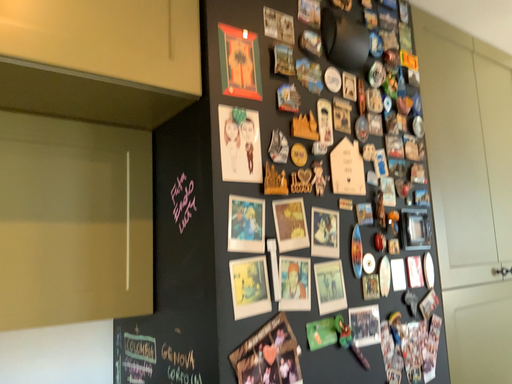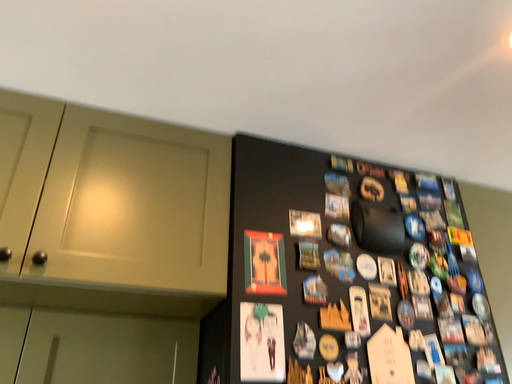
Question: How did the camera likely rotate when shooting the video?

Choices:
 (A) rotated left
 (B) rotated right

Answer: (A)